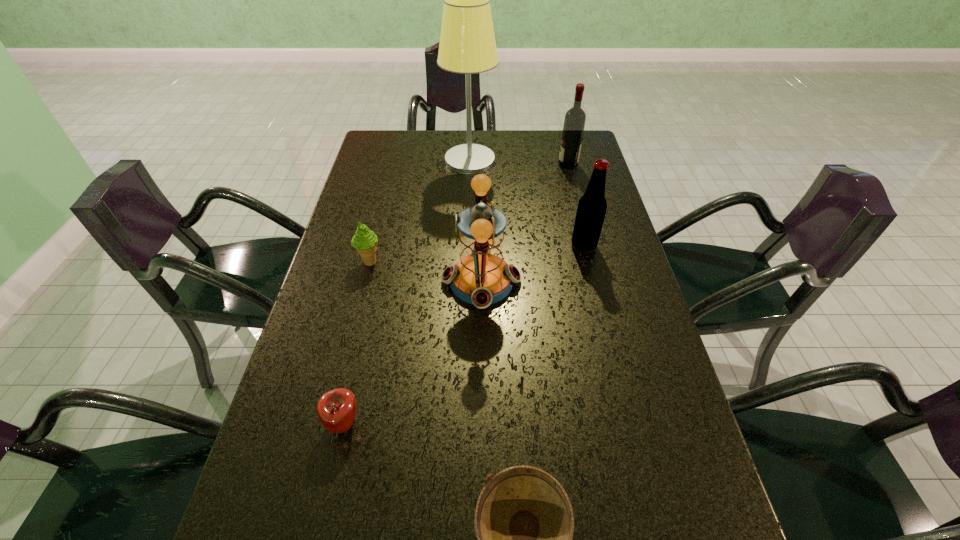
The image size is (960, 540). Identify the location of free region located 0.100m on the front and back of the alcohol. (530, 164).

This screenshot has height=540, width=960. In order to click on free location located 0.190m on the back of the beer bottle in this screenshot , I will do `click(572, 198)`.

The image size is (960, 540). Find the location of `vacant region located 0.290m on the front-facing side of the lantern`. vacant region located 0.290m on the front-facing side of the lantern is located at coordinates (331, 281).

Locate an element on the screen. vacant space located 0.270m on the front-facing side of the lantern is located at coordinates (339, 281).

You are a GUI agent. You are given a task and a screenshot of the screen. Output one action in this format:
    pyautogui.click(x=<x>, y=<y>)
    Task: Click on the vacant space located 0.120m on the front-facing side of the lantern
    
    Given the screenshot: What is the action you would take?
    pyautogui.click(x=396, y=281)

Identify the location of vacant area located 0.190m on the front of the icecream. This screenshot has width=960, height=540. (353, 328).

The height and width of the screenshot is (540, 960). I want to click on free space located on the right of the apple, so click(501, 424).

This screenshot has width=960, height=540. What are the coordinates of `table lamp positioned at the far edge` in the screenshot? It's located at (467, 45).

The image size is (960, 540). I want to click on alcohol located at the far edge, so click(x=575, y=118).

This screenshot has width=960, height=540. Find the location of `icecream that is at the left edge`. icecream that is at the left edge is located at coordinates (365, 241).